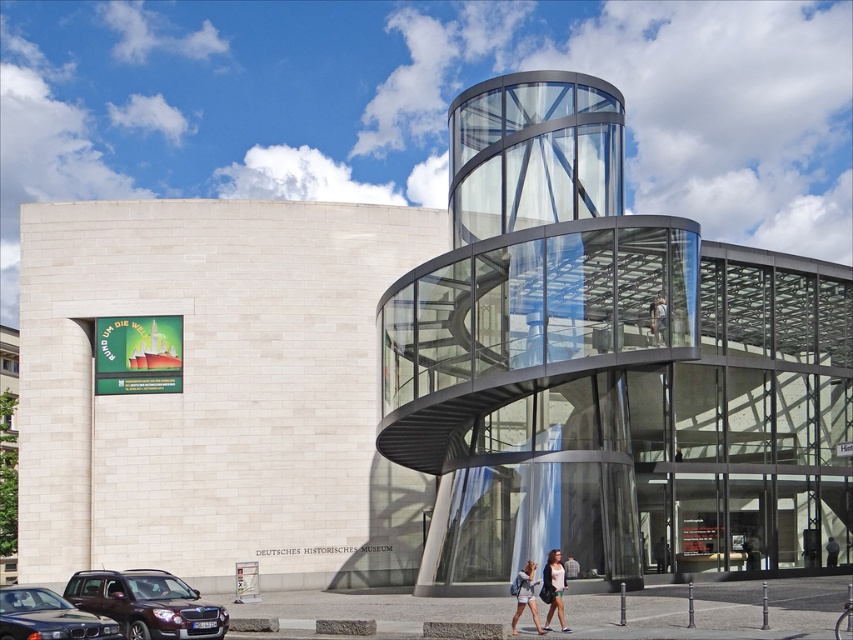
Question: Which of the following is the closest to the observer?

Choices:
 (A) light brown hair at center
 (B) denim jacket at lower center
 (C) matte black car at lower left
 (D) denim shorts at lower center

Answer: (C)

Question: Which point is farther to the camera?

Choices:
 (A) (560, 564)
 (B) (9, 628)

Answer: (A)

Question: Which is farther from the light brown leather jacket at center?

Choices:
 (A) denim jacket at lower center
 (B) denim shorts at lower center
 (C) matte brown suv at lower left

Answer: (C)

Question: Is matte black car at lower left smaller than denim shorts at lower center?

Choices:
 (A) no
 (B) yes

Answer: (B)

Question: Is denim jacket at lower center above light brown hair at center?

Choices:
 (A) no
 (B) yes

Answer: (A)

Question: Is matte black car at lower left smaller than light brown hair at center?

Choices:
 (A) no
 (B) yes

Answer: (A)